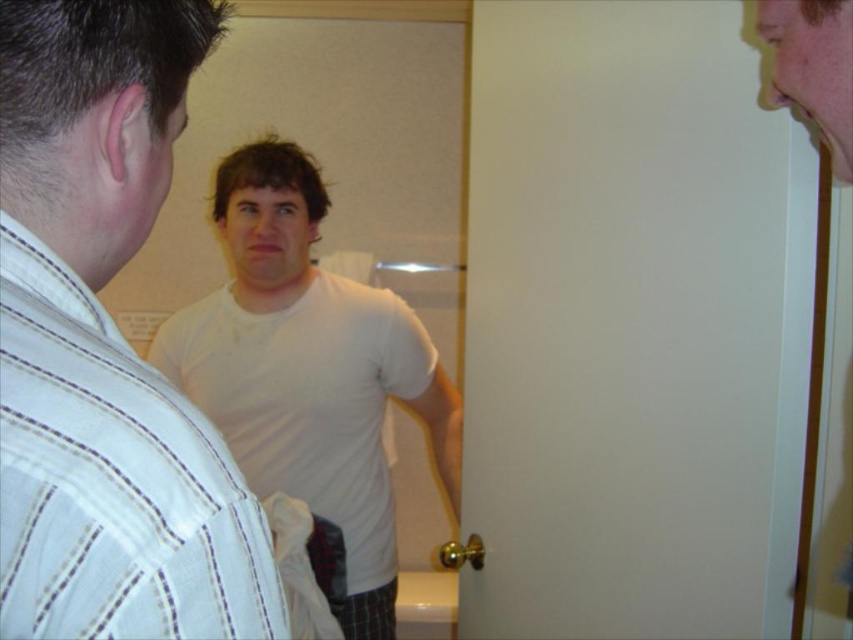
Question: Is white matte t-shirt at center positioned behind smooth skin face at upper right?

Choices:
 (A) yes
 (B) no

Answer: (A)

Question: Where is white cotton t-shirt at center located in relation to smooth skin face at upper right in the image?

Choices:
 (A) below
 (B) above

Answer: (A)

Question: Among these points, which one is nearest to the camera?

Choices:
 (A) (796, 625)
 (B) (126, 113)
 (C) (311, 339)

Answer: (B)

Question: Can you confirm if white cotton t-shirt at center is positioned below white matte t-shirt at center?

Choices:
 (A) yes
 (B) no

Answer: (B)

Question: Which object appears closest to the camera in this image?

Choices:
 (A) white matte t-shirt at center
 (B) white cotton t-shirt at center
 (C) smooth skin face at upper right

Answer: (B)

Question: Which object is farther from the camera taking this photo?

Choices:
 (A) white cotton t-shirt at center
 (B) smooth skin face at upper right
 (C) white matte t-shirt at center

Answer: (C)